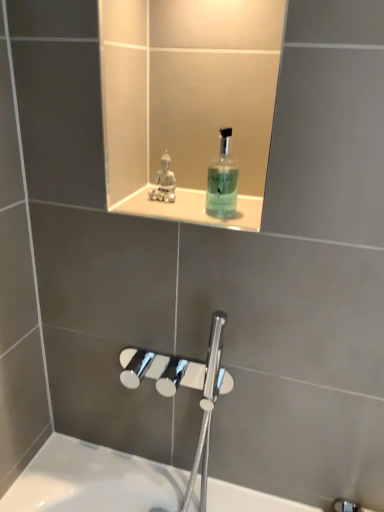
Identify the location of blank space above white glossy ledge at upper center (from a real-world perspective). The image size is (384, 512). (178, 199).